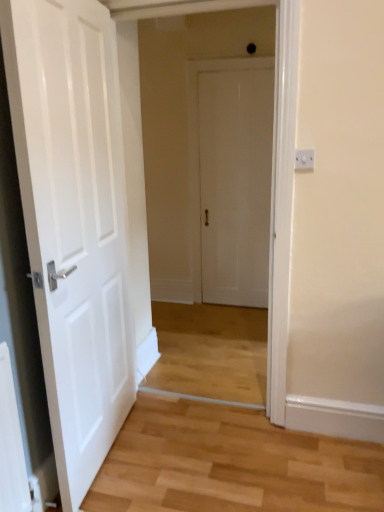
Locate an element on the screen. vacant space in white matte door at center, placed as the second door when sorted from back to front (from a real-world perspective) is located at coordinates (115, 449).